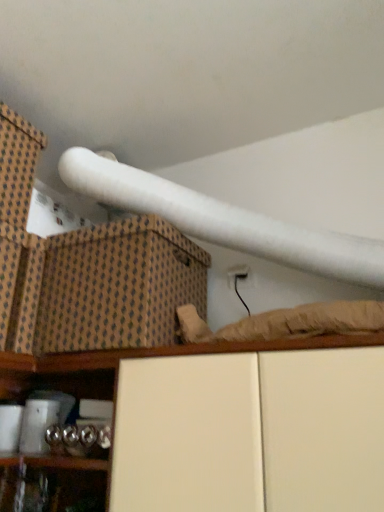
Question: Does brown woven box at upper left have a greater width compared to white matte cabinet at lower center?

Choices:
 (A) no
 (B) yes

Answer: (A)

Question: From the image's perspective, does brown woven box at upper left appear lower than white matte cabinet at lower center?

Choices:
 (A) no
 (B) yes

Answer: (A)

Question: From a real-world perspective, is brown woven box at upper left located beneath white matte cabinet at lower center?

Choices:
 (A) no
 (B) yes

Answer: (A)

Question: Is brown woven box at upper left positioned with its back to white matte cabinet at lower center?

Choices:
 (A) yes
 (B) no

Answer: (B)

Question: Considering the relative sizes of brown woven box at upper left and white matte cabinet at lower center in the image provided, is brown woven box at upper left shorter than white matte cabinet at lower center?

Choices:
 (A) no
 (B) yes

Answer: (B)

Question: From a real-world perspective, is brown woven box at upper left physically above white matte cabinet at lower center?

Choices:
 (A) no
 (B) yes

Answer: (B)

Question: Is brown textured cardboard box at upper left a part of brown woven box at upper left?

Choices:
 (A) yes
 (B) no

Answer: (B)

Question: Are brown woven box at upper left and brown textured cardboard box at upper left located far from each other?

Choices:
 (A) no
 (B) yes

Answer: (A)

Question: From the image's perspective, is brown woven box at upper left beneath brown textured cardboard box at upper left?

Choices:
 (A) yes
 (B) no

Answer: (B)

Question: Considering the relative sizes of brown woven box at upper left and brown textured cardboard box at upper left in the image provided, is brown woven box at upper left smaller than brown textured cardboard box at upper left?

Choices:
 (A) no
 (B) yes

Answer: (B)

Question: Can you confirm if brown woven box at upper left is thinner than brown textured cardboard box at upper left?

Choices:
 (A) no
 (B) yes

Answer: (B)

Question: Is brown woven box at upper left completely or partially outside of brown textured cardboard box at upper left?

Choices:
 (A) yes
 (B) no

Answer: (A)

Question: From the image's perspective, is brown textured cardboard box at upper left above white matte cabinet at lower center?

Choices:
 (A) yes
 (B) no

Answer: (A)